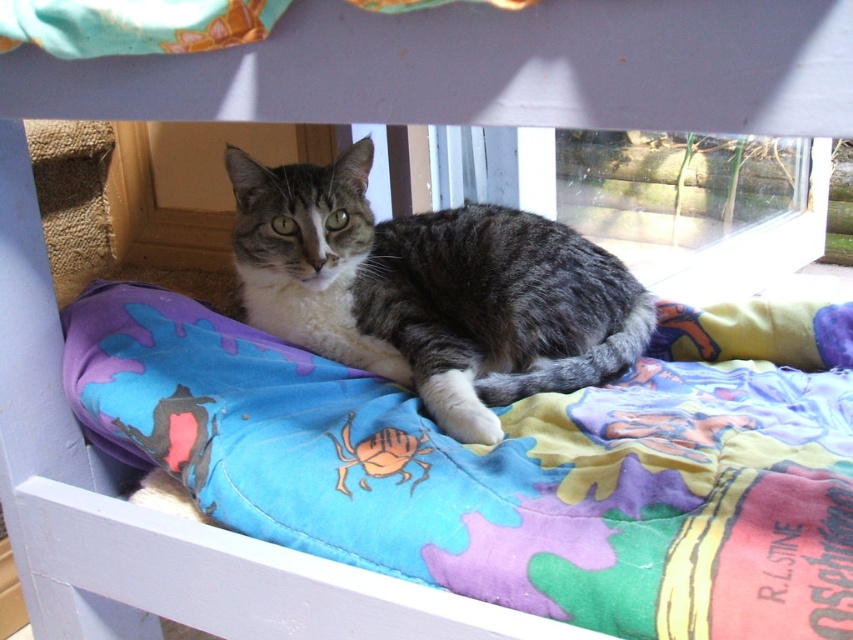
Who is shorter, multicolored quilted blanket at center or gray tabby cat at center?

Standing shorter between the two is multicolored quilted blanket at center.

In the scene shown: Who is more forward, (787,344) or (263,204)?

Positioned in front is point (263,204).

Is point (799, 634) positioned after point (584, 312)?

That is False.

This screenshot has height=640, width=853. What are the coordinates of `multicolored quilted blanket at center` in the screenshot? It's located at (514, 465).